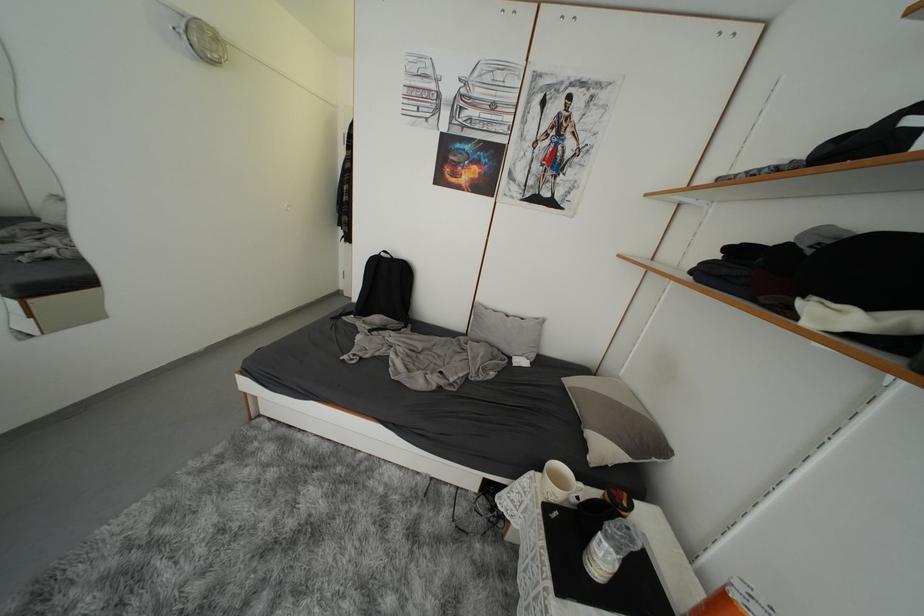
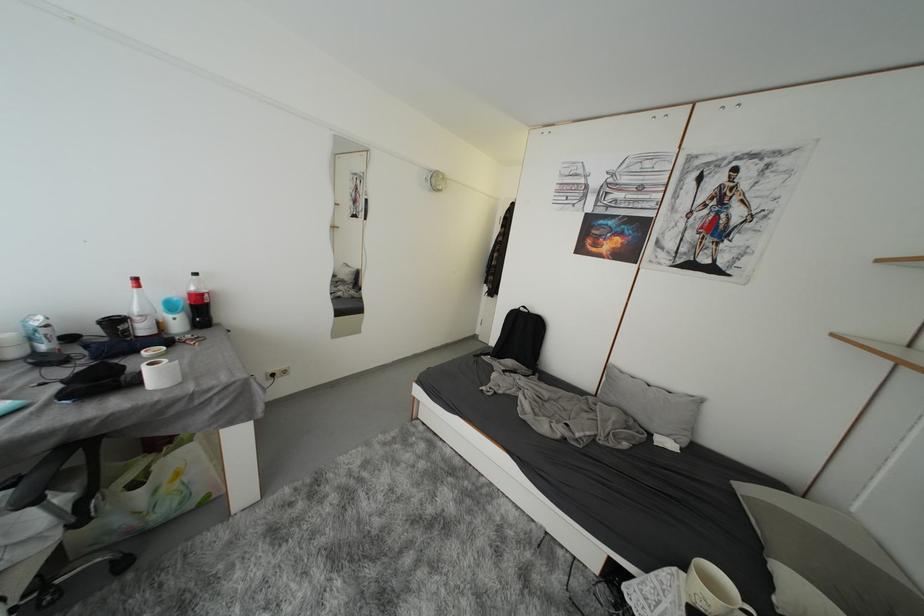
Question: The first image is from the beginning of the video and the second image is from the end. How did the camera likely rotate when shooting the video?

Choices:
 (A) Left
 (B) Right
 (C) Up
 (D) Down

Answer: (A)